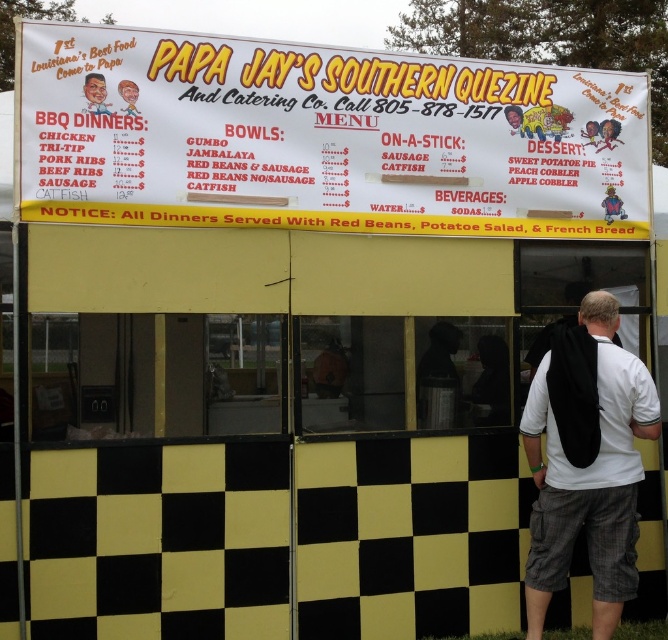
Question: Estimate the real-world distances between objects in this image. Which object is farther from the white fabric backpack at right?

Choices:
 (A) white paper sign at upper center
 (B) smooth plastic cup at upper right
 (C) smooth plastic sign at upper center

Answer: (C)

Question: Can you confirm if white paper sign at upper center is positioned to the right of matte black sign at upper center?

Choices:
 (A) yes
 (B) no

Answer: (A)

Question: Estimate the real-world distances between objects in this image. Which object is farther from the white fabric backpack at right?

Choices:
 (A) smooth plastic head at upper left
 (B) matte black sign at upper center

Answer: (A)

Question: Is white paper sign at upper center below smooth plastic cup at upper right?

Choices:
 (A) yes
 (B) no

Answer: (B)

Question: From the image, what is the correct spatial relationship of white fabric backpack at right in relation to smooth plastic cup at upper right?

Choices:
 (A) below
 (B) above

Answer: (A)

Question: Which object is positioned farthest from the white fabric backpack at right?

Choices:
 (A) smooth plastic cup at upper right
 (B) white paper sign at upper center
 (C) smooth plastic sign at upper center
 (D) matte black sign at upper center

Answer: (D)